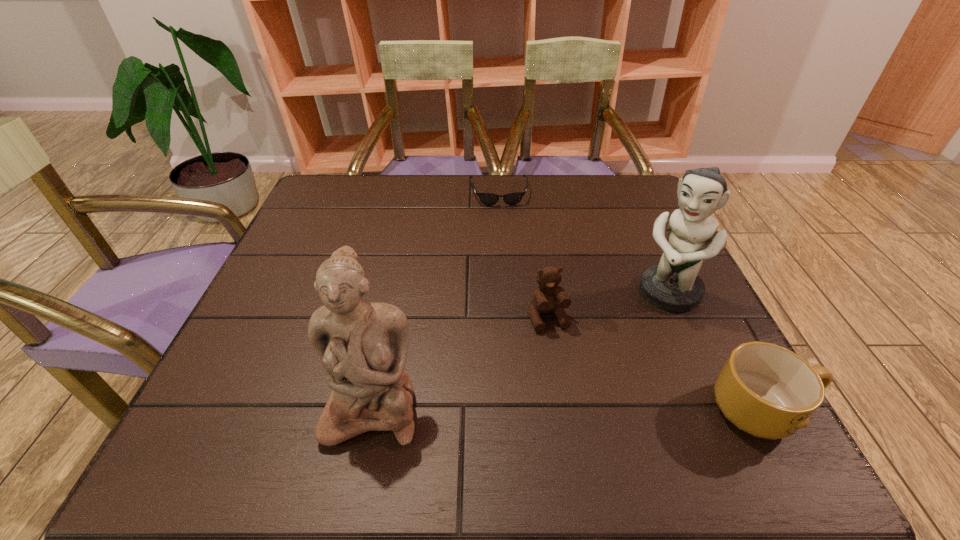
Identify the location of vacant space on the desktop that is between the nearer figurine and the mug and is positioned on the front-facing side of the sunglasses. (525, 408).

The image size is (960, 540). Identify the location of vacant space on the desktop that is between the leftmost object and the mug and is positioned on the face of the teddy bear. pos(583,408).

The image size is (960, 540). What are the coordinates of `vacant space on the desktop that is between the nearer figurine and the second shortest object and is positioned on the front-facing side of the right figurine` in the screenshot? It's located at (574, 408).